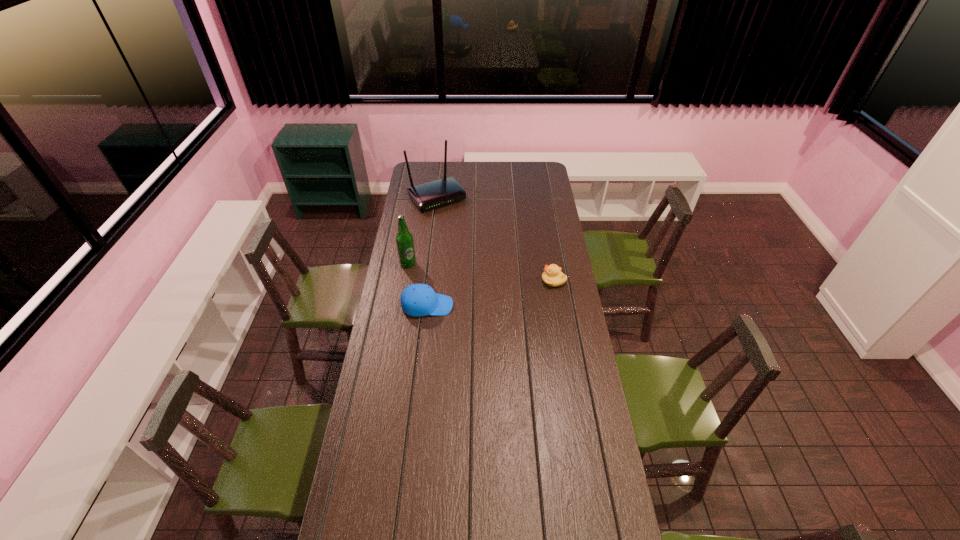
Where is `vacant space on the desktop that is between the nearest object and the duckling and is positioned on the label of the second farthest object`? vacant space on the desktop that is between the nearest object and the duckling and is positioned on the label of the second farthest object is located at coordinates (510, 289).

I want to click on vacant space on the desktop that is between the cap and the rightmost object and is positioned on the front-facing side of the router, so click(511, 289).